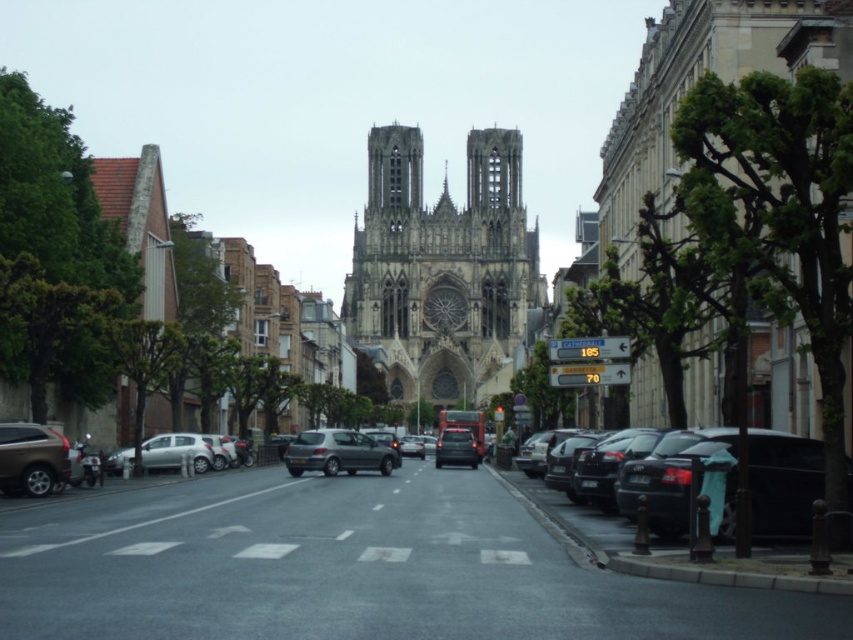
You are a tourist standing on the sidewalk and see the stone gothic cathedral at center and the satin silver hatchback at center. Which object is positioned higher in the image?

The stone gothic cathedral at center is positioned higher than the satin silver hatchback at center in the image.

You are standing at the intersection and want to take a photo of the stone gothic cathedral at center. Which direction should you face to capture it in your camera?

You should face towards the center of the scene to capture the stone gothic cathedral at center, as it is located at point coordinates approximately 0.422 on the x axis and 0.519 on the y axis.

You are a pedestrian standing on the sidewalk and see the stone gothic cathedral at center and the matte brown suv at lower left. Which object is closer to you?

The stone gothic cathedral at center is closer to you because the matte brown suv at lower left is behind it.